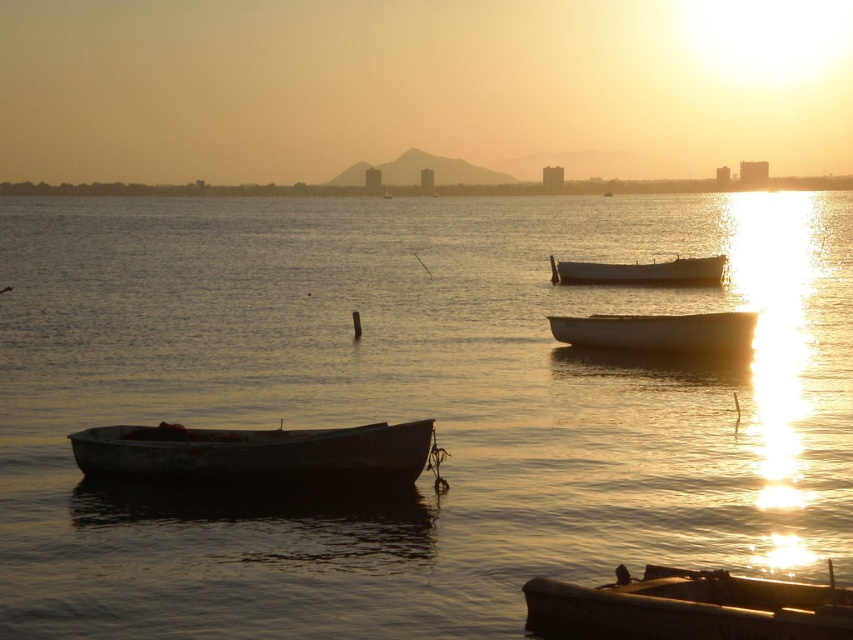
Question: Which object appears farthest from the camera in this image?

Choices:
 (A) rusty metal boat at left
 (B) rusty metal boat at lower right

Answer: (A)

Question: Which of the following is the closest to the observer?

Choices:
 (A) rusty metal boat at center
 (B) rusty metal boat at left
 (C) smooth water at center

Answer: (C)

Question: Is white matte boat at center to the right of rusty metal boat at center from the viewer's perspective?

Choices:
 (A) no
 (B) yes

Answer: (A)

Question: Is rusty metal boat at left above rusty metal boat at center?

Choices:
 (A) yes
 (B) no

Answer: (B)

Question: In this image, where is rusty metal boat at left located relative to rusty metal boat at lower right?

Choices:
 (A) right
 (B) left

Answer: (B)

Question: Estimate the real-world distances between objects in this image. Which object is closer to the rusty metal boat at lower right?

Choices:
 (A) rusty metal boat at center
 (B) rusty metal boat at left
 (C) smooth water at center
 (D) white matte boat at center

Answer: (B)